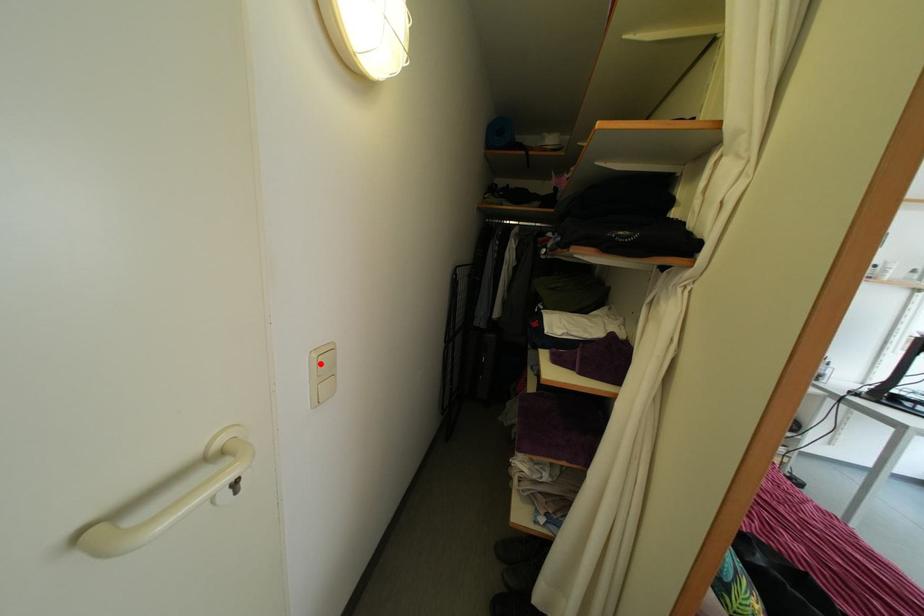
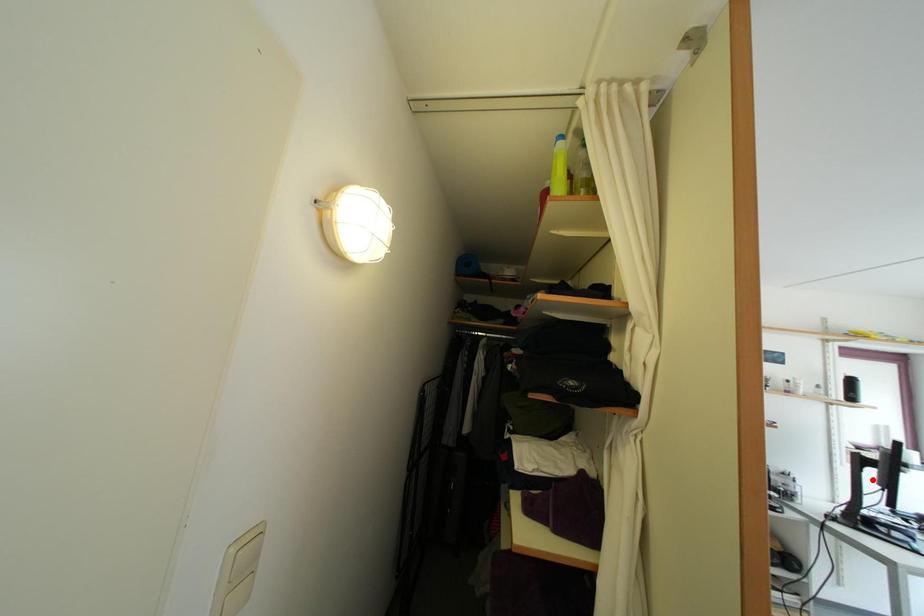
I am providing you with two images of the same scene from different viewpoints. A red point is marked on the first image and another point is marked on the second image. Is the red point in image1 aligned with the point shown in image2?

No